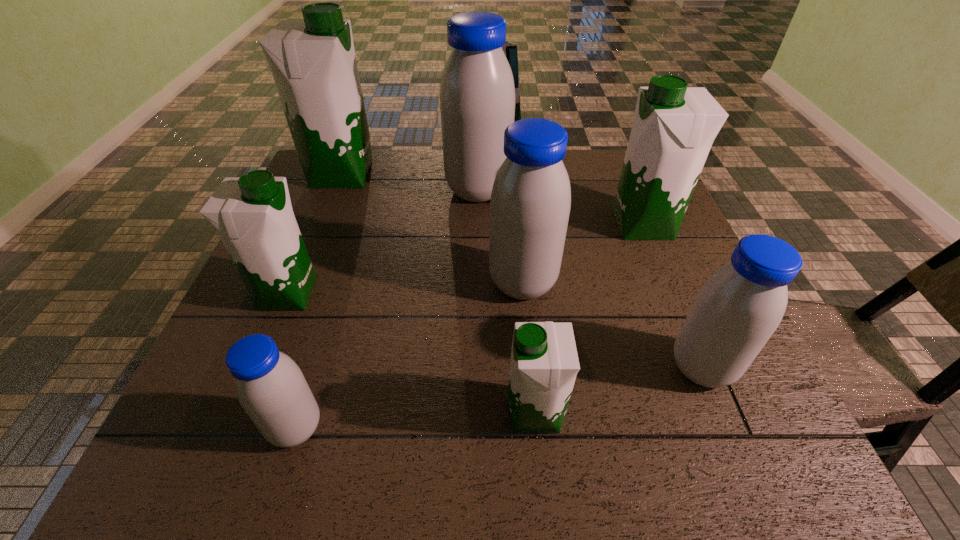
Locate an element on the screen. the biggest green soya milk is located at coordinates (313, 63).

At what (x,y) coordinates should I click in order to perform the action: click on the farthest blue soya milk. Please return your answer as a coordinate pair (x, y). The height and width of the screenshot is (540, 960). Looking at the image, I should click on pyautogui.click(x=477, y=96).

Find the location of a particular element. The height and width of the screenshot is (540, 960). the second farthest green soya milk is located at coordinates (674, 126).

Identify the location of the third smallest green soya milk. (674, 126).

In order to click on the second biggest blue soya milk in this screenshot , I will do `click(530, 203)`.

The image size is (960, 540). I want to click on the second smallest green soya milk, so coord(253,215).

Image resolution: width=960 pixels, height=540 pixels. Find the location of `the rightmost blue soya milk`. the rightmost blue soya milk is located at coordinates (739, 307).

Find the location of a particular element. the second smallest blue soya milk is located at coordinates (739, 307).

This screenshot has height=540, width=960. In order to click on the third green soya milk from left to right in this screenshot , I will do `click(544, 363)`.

Where is `the smallest green soya milk`? the smallest green soya milk is located at coordinates (544, 363).